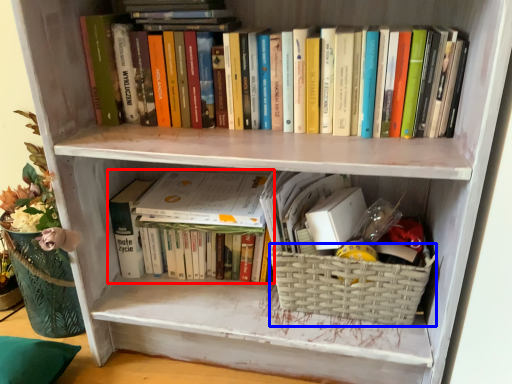
Question: Which of the following is the farthest to the observer, book (highlighted by a red box) or basket (highlighted by a blue box)?

Choices:
 (A) book
 (B) basket

Answer: (A)